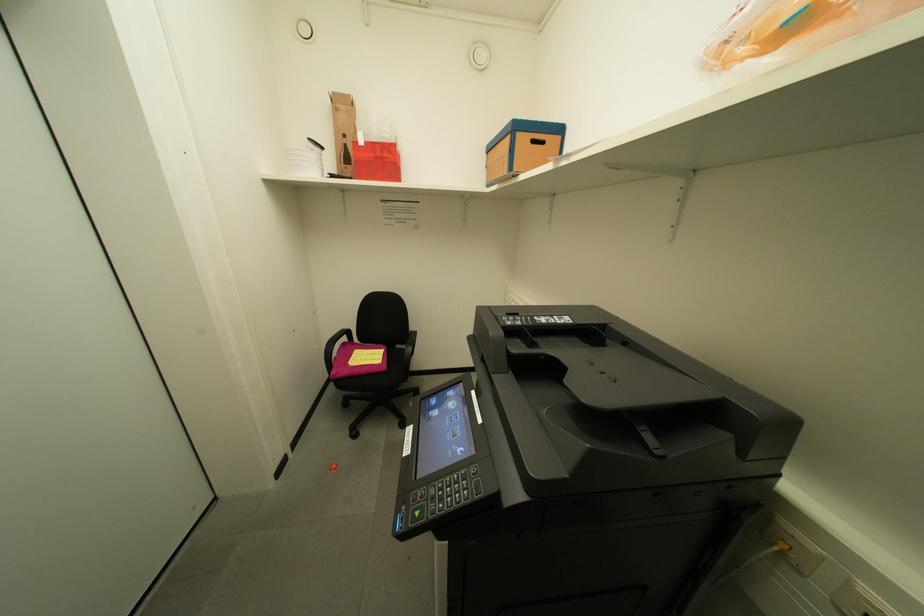
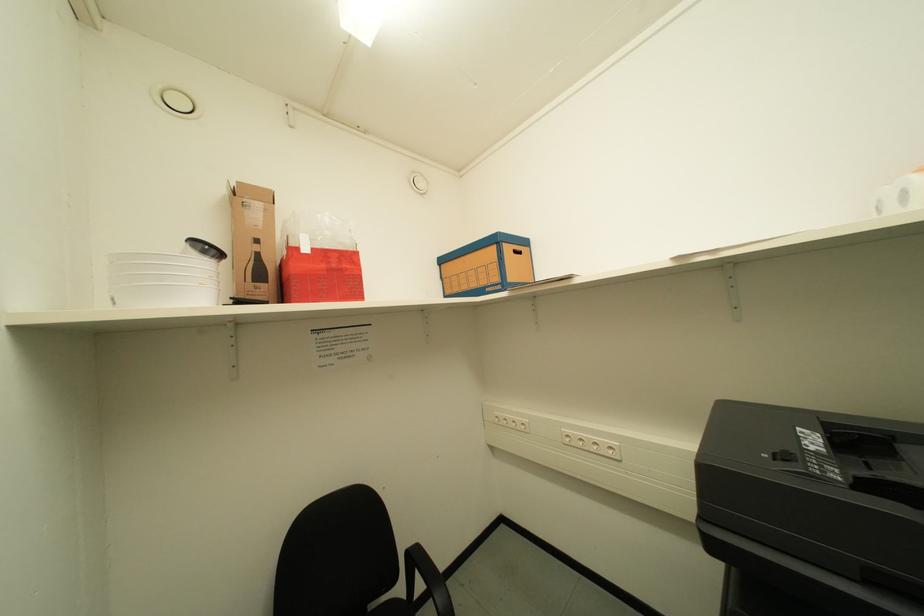
Looking at this image, first-person continuous shooting, in which direction is the camera rotating?

The camera rotated toward right-up.